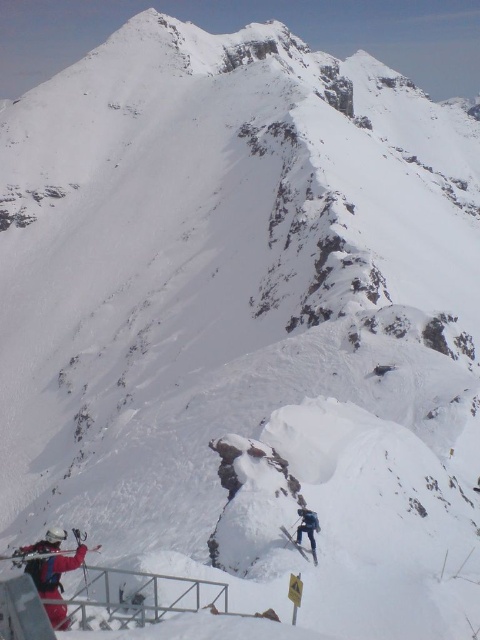
Question: Among these points, which one is farthest from the camera?

Choices:
 (A) (310, 529)
 (B) (29, 557)

Answer: (A)

Question: Which point appears closest to the camera in this image?

Choices:
 (A) (311, 541)
 (B) (44, 596)

Answer: (B)

Question: Is red fabric jacket at lower left wider than dark blue ski suit at center?

Choices:
 (A) yes
 (B) no

Answer: (A)

Question: Which object is farther from the camera taking this photo?

Choices:
 (A) red fabric jacket at lower left
 (B) dark blue ski suit at center

Answer: (B)

Question: Does red fabric jacket at lower left have a larger size compared to dark blue ski suit at center?

Choices:
 (A) no
 (B) yes

Answer: (B)

Question: Can you confirm if red fabric jacket at lower left is positioned to the left of dark blue ski suit at center?

Choices:
 (A) yes
 (B) no

Answer: (A)